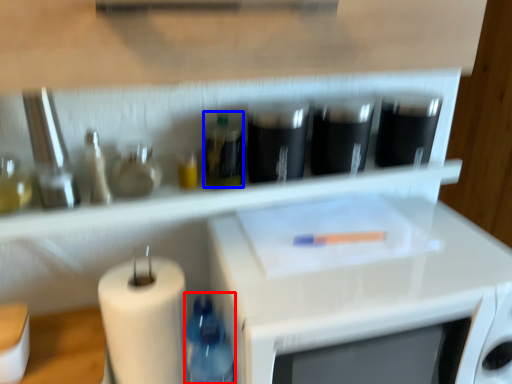
Question: Which point is further to the camera, bottle (highlighted by a red box) or bottle (highlighted by a blue box)?

Choices:
 (A) bottle
 (B) bottle

Answer: (B)